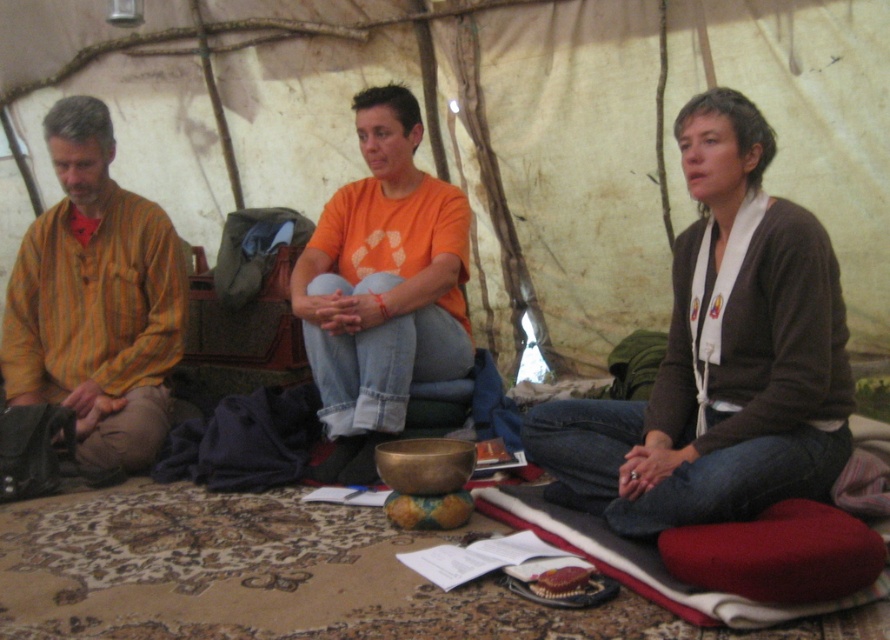
Based on the coordinates provided, which object in the scene is located at point (96, 300)?

The yellow striped fabric at left is located at point (96, 300).

You are organizing a small group activity in a tent. You need to place a 1.2 meter wide mat between the brown cardigan at center and the yellow striped fabric at left. Can the mat fit between them?

The brown cardigan at center is wider than the yellow striped fabric at left. Therefore, the 1.2 meter wide mat cannot fit between them because the space between the two objects is narrower than the mat.